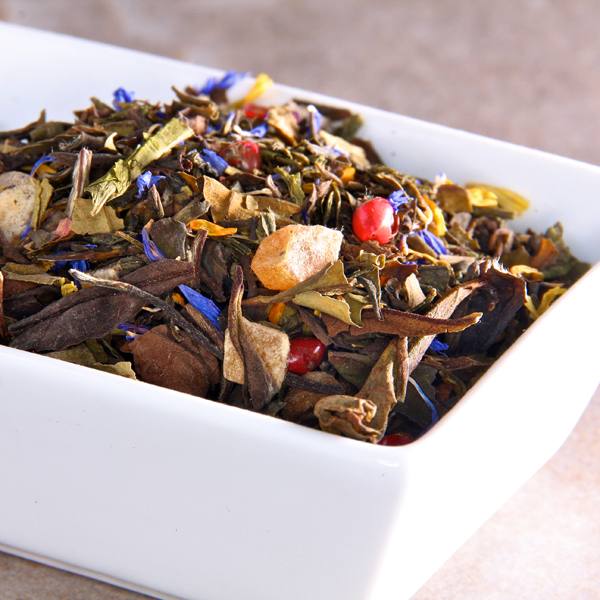
You are a GUI agent. You are given a task and a screenshot of the screen. Output one action in this format:
    pyautogui.click(x=<x>, y=<y>)
    Task: Click on the bowl
    This screenshot has height=600, width=600.
    Given the screenshot: What is the action you would take?
    pyautogui.click(x=312, y=536)